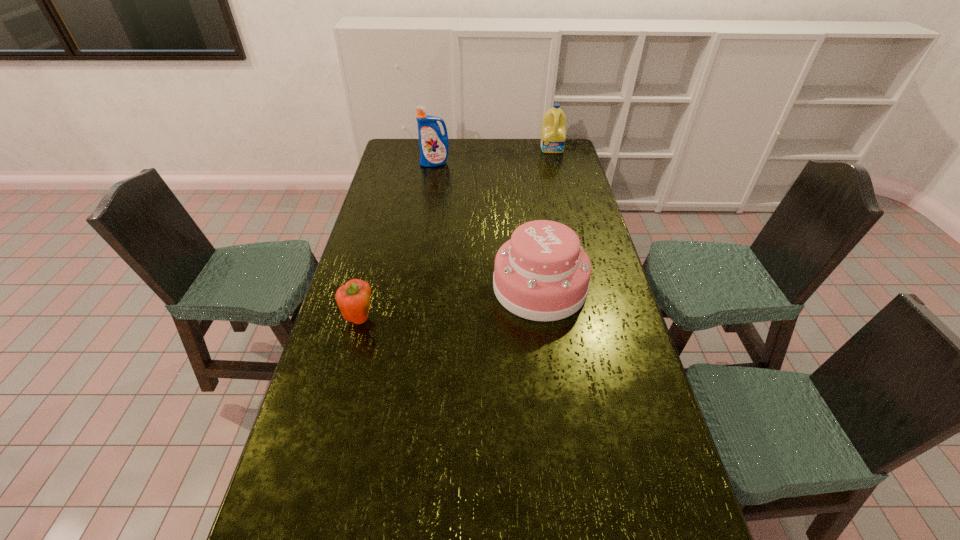
The image size is (960, 540). In order to click on empty location between the pepper and the right detergent in this screenshot , I will do `click(456, 234)`.

The height and width of the screenshot is (540, 960). I want to click on free area in between the left detergent and the pepper, so click(397, 241).

Identify the location of blank region between the shorter detergent and the taller detergent. This screenshot has width=960, height=540. (493, 156).

Find the location of a particular element. empty space that is in between the shortest object and the cake is located at coordinates (449, 303).

The width and height of the screenshot is (960, 540). Find the location of `free point between the cake and the farther detergent`. free point between the cake and the farther detergent is located at coordinates (546, 218).

Where is `empty space that is in between the farthest object and the pepper`? empty space that is in between the farthest object and the pepper is located at coordinates (456, 234).

Image resolution: width=960 pixels, height=540 pixels. Identify the location of vacant area that lies between the pepper and the cake. (449, 303).

I want to click on vacant point located between the farthest object and the leftmost object, so click(x=456, y=234).

This screenshot has width=960, height=540. I want to click on object that stands as the closest to the cake, so click(x=354, y=298).

This screenshot has height=540, width=960. Identify the location of object that is the second closest to the leftmost object. (434, 147).